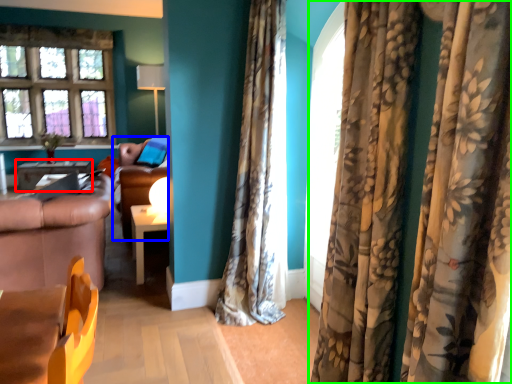
Question: Which object is the closest to the table (highlighted by a red box)? Choose among these: couch (highlighted by a blue box) or curtain (highlighted by a green box).

Choices:
 (A) couch
 (B) curtain

Answer: (A)